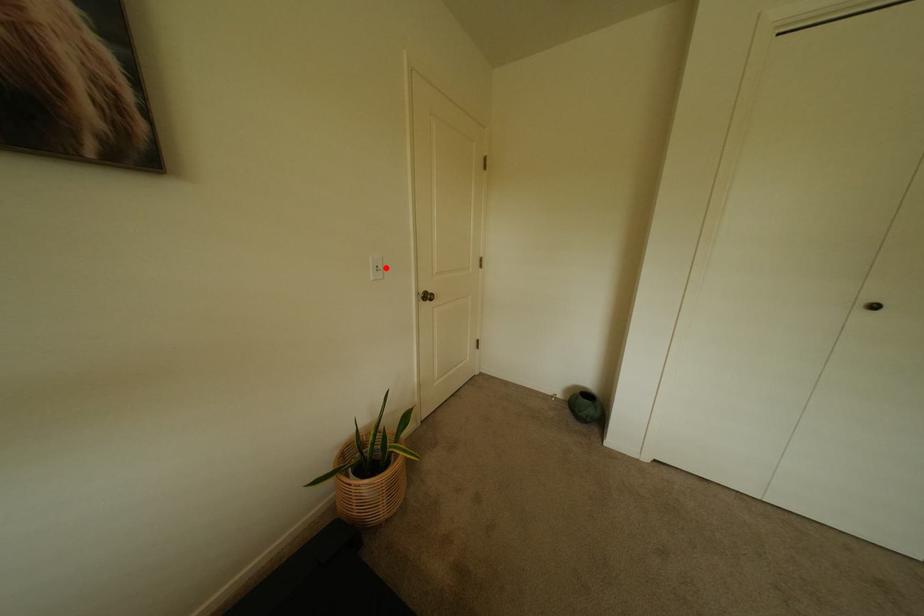
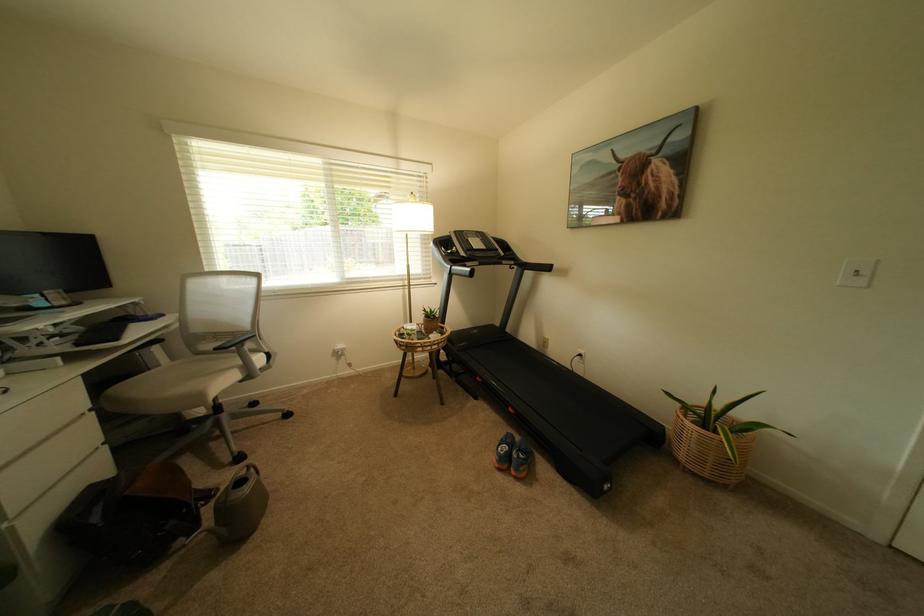
In the second image, find the point that corresponds to the highlighted location in the first image.

(866, 272)